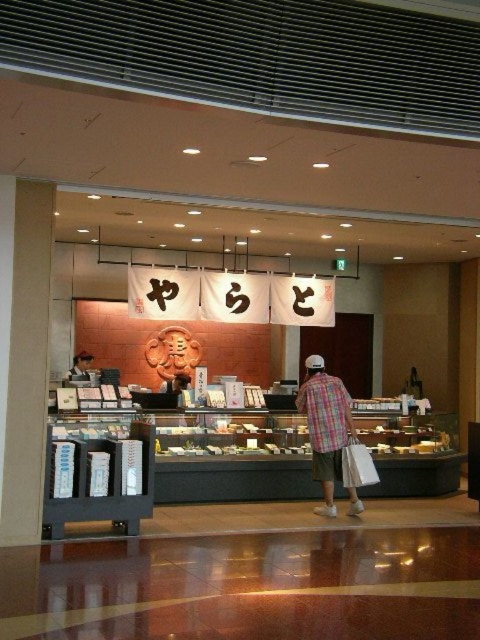
You are a customer in the shop and want to choose between the plaid fabric shirt at center and the matte black shirt at center. Which one is located to the right side of the other?

The plaid fabric shirt at center is positioned on the right side of matte black shirt at center.

You are a customer in the shop and want to know which shirt is taller between the plaid fabric shirt at center and the matte black shirt at center. Which one is taller?

The plaid fabric shirt at center is much taller than the matte black shirt at center.